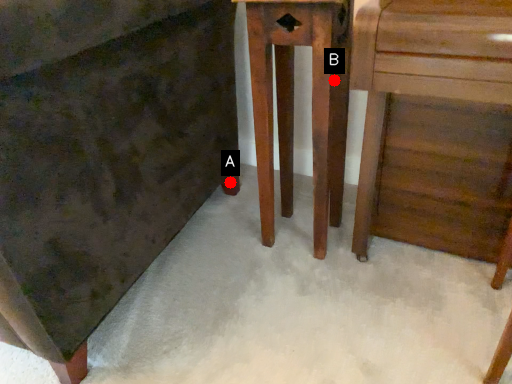
Question: Two points are circled on the image, labeled by A and B beside each circle. Which point is closer to the camera?

Choices:
 (A) A is closer
 (B) B is closer

Answer: (B)